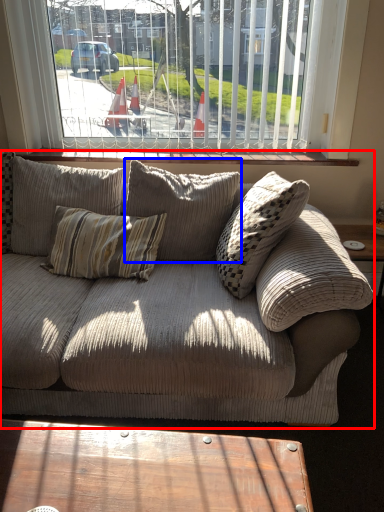
Question: Which point is closer to the camera, studio couch (highlighted by a red box) or pillow (highlighted by a blue box)?

Choices:
 (A) studio couch
 (B) pillow

Answer: (A)